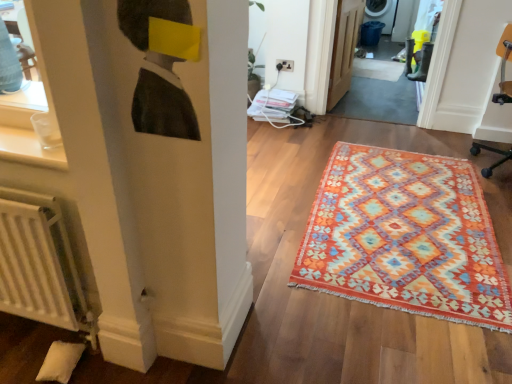
Question: Considering the relative positions of orange fabric swivel chair at right and multicolored woven rug at center in the image provided, is orange fabric swivel chair at right to the left of multicolored woven rug at center from the viewer's perspective?

Choices:
 (A) yes
 (B) no

Answer: (B)

Question: Is orange fabric swivel chair at right further to the viewer compared to multicolored woven rug at center?

Choices:
 (A) yes
 (B) no

Answer: (A)

Question: Is orange fabric swivel chair at right positioned with its back to multicolored woven rug at center?

Choices:
 (A) yes
 (B) no

Answer: (B)

Question: Are orange fabric swivel chair at right and multicolored woven rug at center making contact?

Choices:
 (A) yes
 (B) no

Answer: (B)

Question: Can you confirm if orange fabric swivel chair at right is shorter than multicolored woven rug at center?

Choices:
 (A) yes
 (B) no

Answer: (B)

Question: Relative to orange woven rug at center, is wooden door at center in front or behind?

Choices:
 (A) behind
 (B) front

Answer: (B)

Question: From the image's perspective, relative to orange woven rug at center, is wooden door at center above or below?

Choices:
 (A) below
 (B) above

Answer: (A)

Question: Is wooden door at center spatially inside orange woven rug at center, or outside of it?

Choices:
 (A) outside
 (B) inside

Answer: (A)

Question: From a real-world perspective, relative to orange woven rug at center, is wooden door at center vertically above or below?

Choices:
 (A) below
 (B) above

Answer: (B)

Question: From the image's perspective, relative to orange fabric swivel chair at right, is orange woven rug at center above or below?

Choices:
 (A) below
 (B) above

Answer: (B)

Question: Considering the positions of orange woven rug at center and orange fabric swivel chair at right in the image, is orange woven rug at center taller or shorter than orange fabric swivel chair at right?

Choices:
 (A) short
 (B) tall

Answer: (A)

Question: Looking at the image, does orange woven rug at center seem bigger or smaller compared to orange fabric swivel chair at right?

Choices:
 (A) small
 (B) big

Answer: (A)

Question: Based on their positions, is orange woven rug at center located to the left or right of orange fabric swivel chair at right?

Choices:
 (A) right
 (B) left

Answer: (B)

Question: Considering the positions of multicolored woven rug at center and white matte radiator at lower left in the image, is multicolored woven rug at center bigger or smaller than white matte radiator at lower left?

Choices:
 (A) small
 (B) big

Answer: (B)

Question: In the image, is multicolored woven rug at center positioned in front of or behind white matte radiator at lower left?

Choices:
 (A) behind
 (B) front

Answer: (A)